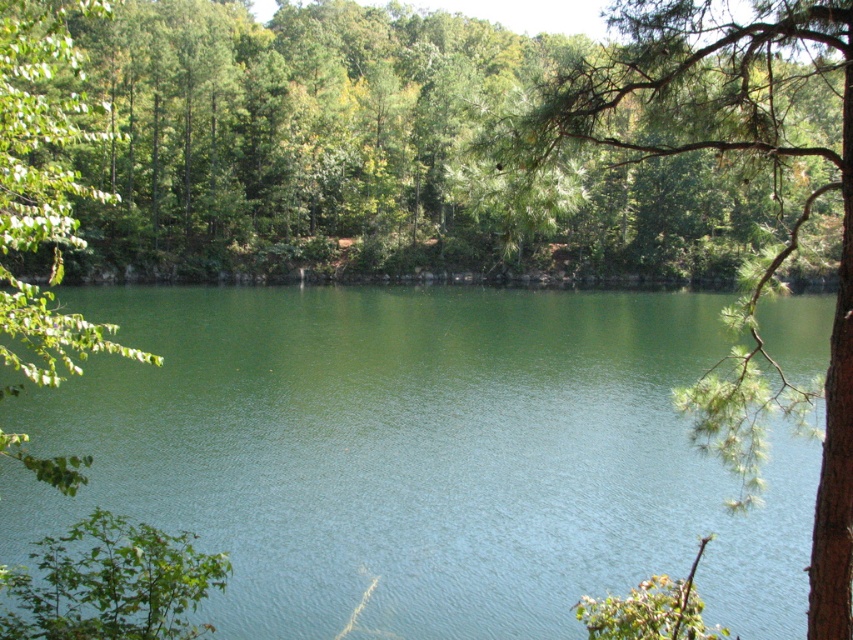
Is point (91, 401) less distant than point (833, 83)?

No.

What are the coordinates of `green liquid water at center` in the screenshot? It's located at (416, 456).

Locate an element on the screen. The image size is (853, 640). green liquid water at center is located at coordinates pyautogui.click(x=416, y=456).